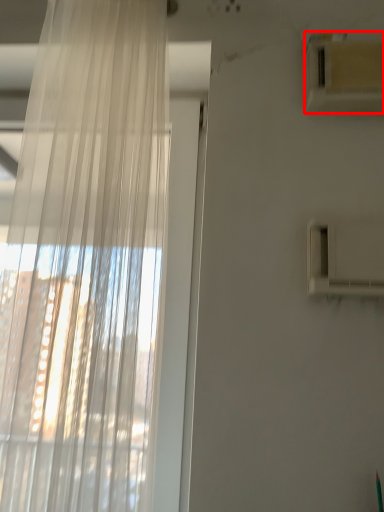
Question: Observing the image, what is the correct spatial positioning of air conditioning (annotated by the red box) in reference to curtain?

Choices:
 (A) right
 (B) left

Answer: (A)